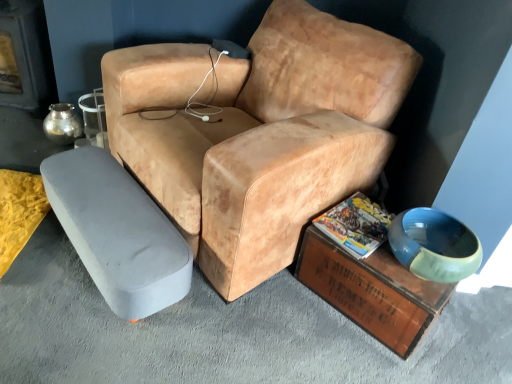
The height and width of the screenshot is (384, 512). I want to click on vacant region in front of gray fabric ottoman at lower left, acting as the first table starting from the left, so click(75, 330).